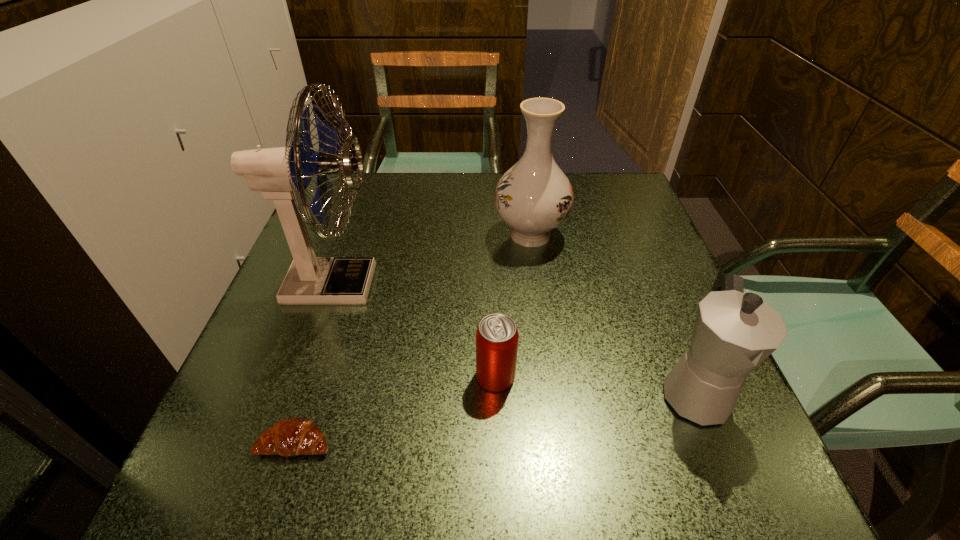
Identify the location of free space between the fourth shortest object and the crescent roll. click(x=413, y=338).

Locate an element on the screen. vacant space that's between the shortest object and the third shortest object is located at coordinates (494, 417).

Find the location of a particular element. Image resolution: width=960 pixels, height=540 pixels. free space between the rightmost object and the shortest object is located at coordinates (494, 417).

Identify the location of object that is the fourth closest to the tallest object. This screenshot has height=540, width=960. (734, 332).

Where is `object identified as the closest to the tallest object`? object identified as the closest to the tallest object is located at coordinates pos(294,436).

The height and width of the screenshot is (540, 960). I want to click on vacant space that satisfies the following two spatial constraints: 1. on the back side of the can; 2. on the right side of the vase, so click(x=492, y=235).

At what (x,y) coordinates should I click in order to perform the action: click on free point that satisfies the following two spatial constraints: 1. on the front side of the can; 2. on the right side of the rightmost object. Please return your answer as a coordinate pair (x, y). Looking at the image, I should click on (496, 392).

In order to click on free location that satisfies the following two spatial constraints: 1. on the front-facing side of the fan; 2. on the back side of the coffeepot in this screenshot , I will do tap(296, 392).

Identify the location of free location that satisfies the following two spatial constraints: 1. on the front-facing side of the fan; 2. on the right side of the can. (301, 376).

Find the location of a particular element. vacant space that satisfies the following two spatial constraints: 1. on the front-facing side of the fan; 2. on the right side of the can is located at coordinates (301, 376).